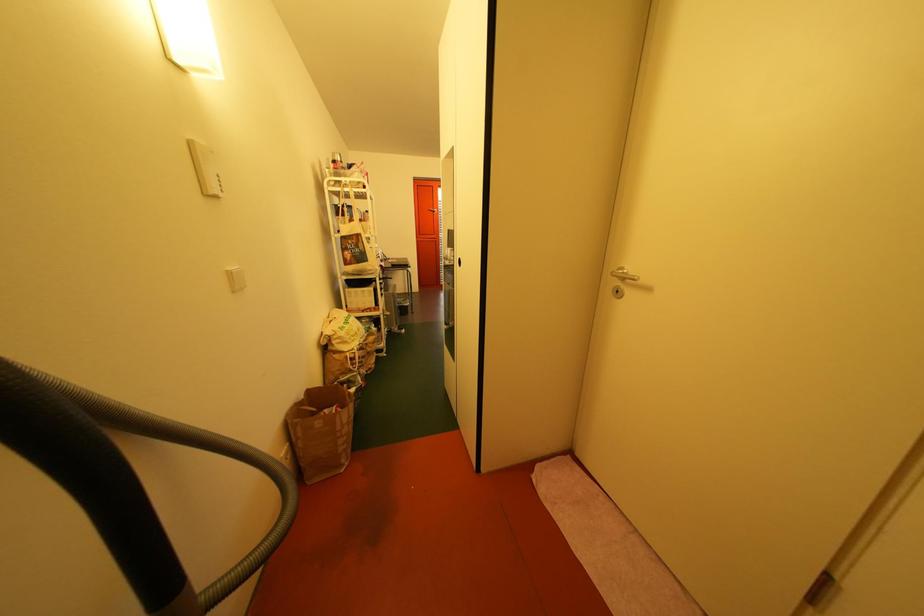
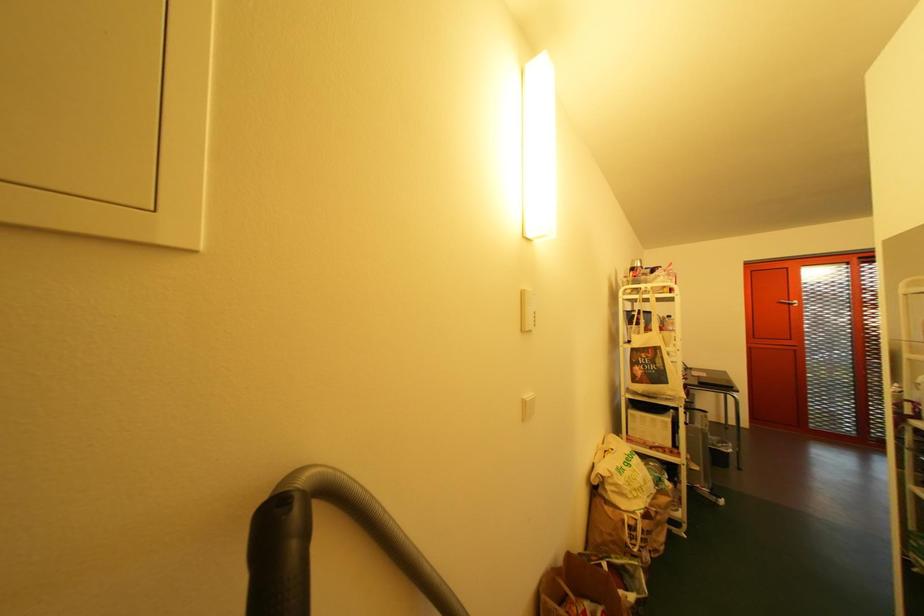
Question: The camera is either moving clockwise (left) or counter-clockwise (right) around the object. The first image is from the beginning of the video and the second image is from the end. Is the camera moving left or right when shooting the video?

Choices:
 (A) Left
 (B) Right

Answer: (B)